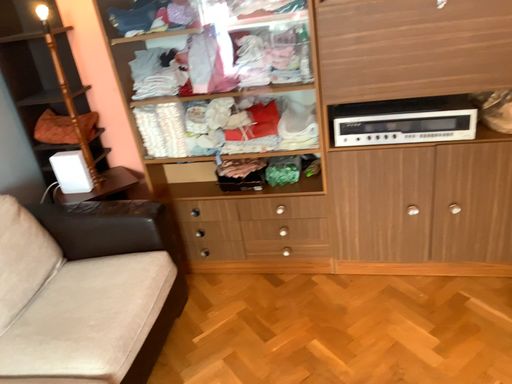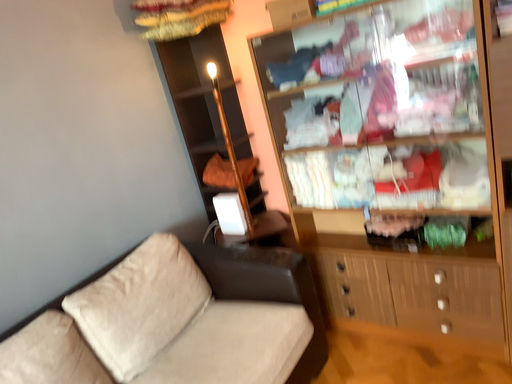
Question: Which way did the camera rotate in the video?

Choices:
 (A) rotated left
 (B) rotated right

Answer: (A)